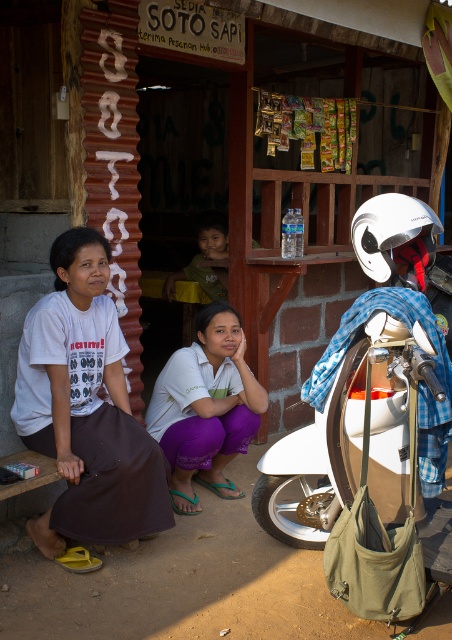
You are a fashion designer observing the clothing items in the scene. Which clothing item, the purple fabric skirt at lower left or the green fabric shirt at upper center, is taller?

The purple fabric skirt at lower left has a greater height compared to the green fabric shirt at upper center.